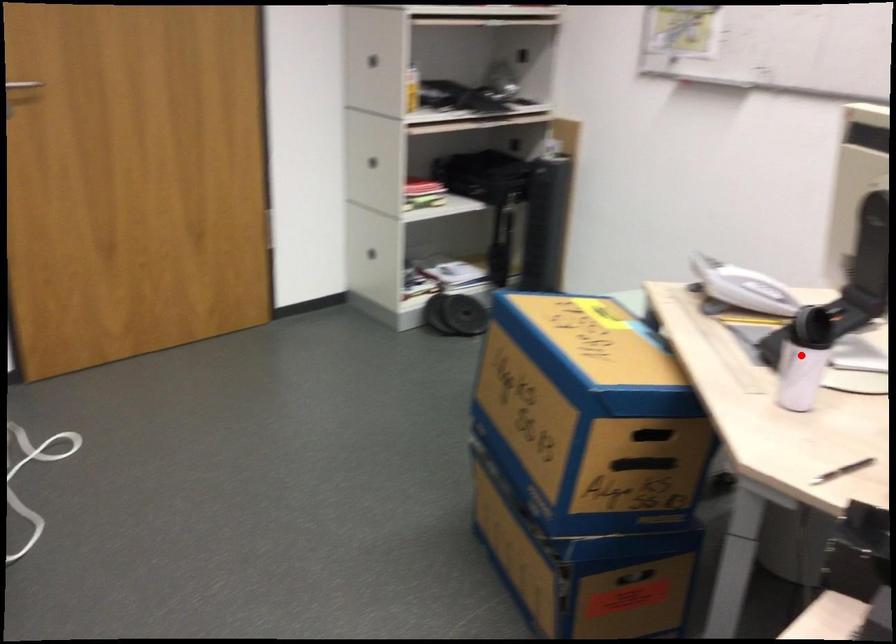
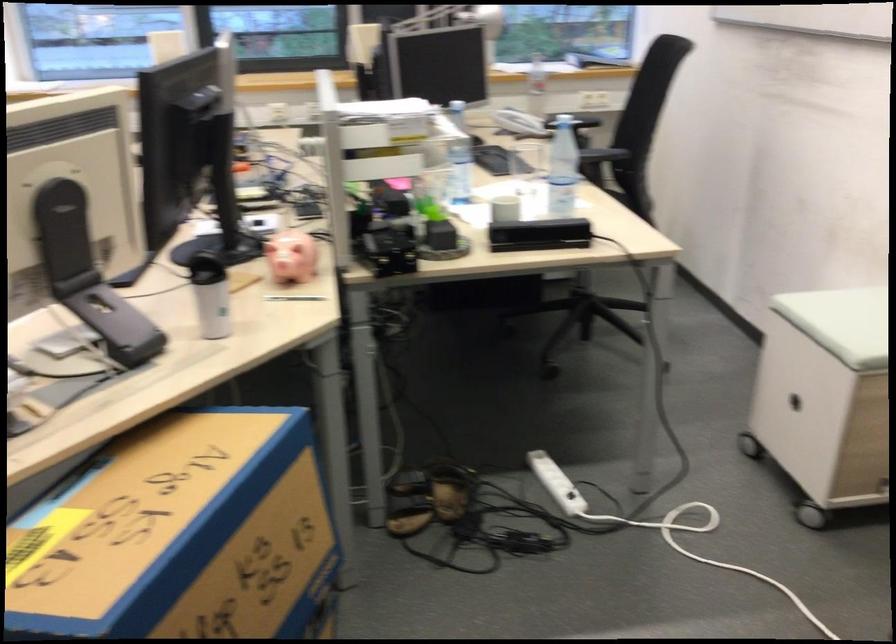
Question: I am providing you with two images of the same scene from different viewpoints. Given a red point in image1, look at the same physical point in image2. Is it:

Choices:
 (A) Closer to the viewpoint
 (B) Farther from the viewpoint

Answer: (B)